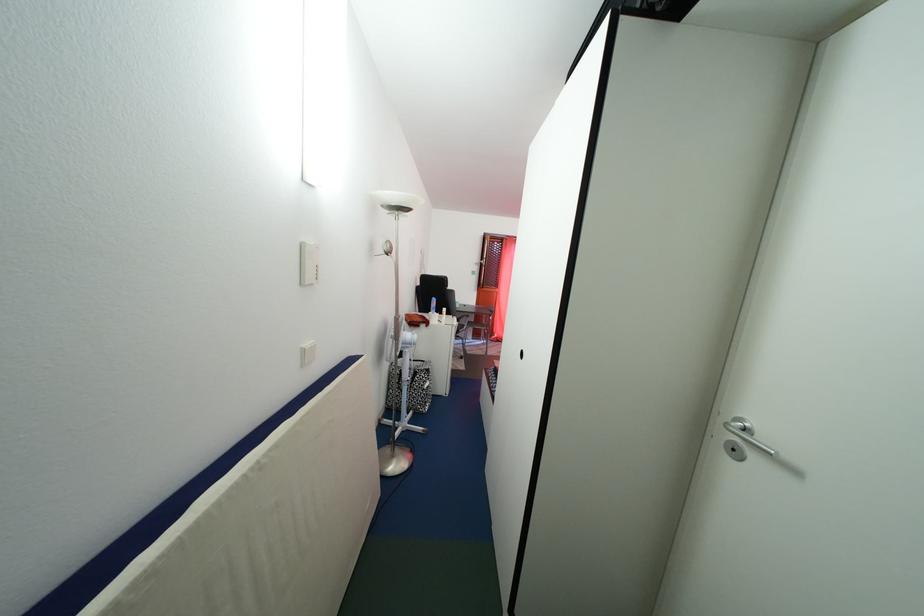
The height and width of the screenshot is (616, 924). Find the location of `recessed cabinet handle`. recessed cabinet handle is located at coordinates (744, 438).